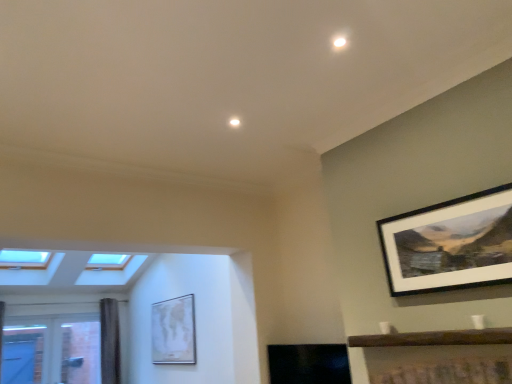
Where is `matte white map at center, the second picture frame positioned from the top`? The height and width of the screenshot is (384, 512). matte white map at center, the second picture frame positioned from the top is located at coordinates (173, 331).

Locate an element on the screen. wooden shelf at lower right is located at coordinates (435, 338).

Identify the location of matte white map at center, acting as the second picture frame starting from the front. (173, 331).

This screenshot has height=384, width=512. What are the coordinates of `window sill in front of the wooden-framed print at upper right, acting as the first picture frame starting from the front` in the screenshot? It's located at (435, 338).

Consider the image. Is wooden-framed print at upper right, the 1th picture frame in the top-to-bottom sequence, thinner than wooden shelf at lower right?

Yes, wooden-framed print at upper right, the 1th picture frame in the top-to-bottom sequence, is thinner than wooden shelf at lower right.

From a real-world perspective, relative to wooden shelf at lower right, is wooden-framed print at upper right, the second picture frame viewed from the left, vertically above or below?

wooden-framed print at upper right, the second picture frame viewed from the left, is situated higher than wooden shelf at lower right in the real world.

Between clear glass window at lower left and wooden shelf at lower right, which one appears on the right side from the viewer's perspective?

wooden shelf at lower right.

Considering their positions, is clear glass window at lower left located in front of or behind wooden shelf at lower right?

clear glass window at lower left is behind wooden shelf at lower right.

Are clear glass window at lower left and wooden shelf at lower right located far from each other?

Yes, clear glass window at lower left and wooden shelf at lower right are located far from each other.

Does clear glass window at lower left have a larger size compared to wooden shelf at lower right?

Indeed, clear glass window at lower left has a larger size compared to wooden shelf at lower right.

From the image's perspective, is matte white map at center, marked as the 2th picture frame in a right-to-left arrangement, beneath dark gray textured curtain at left?

No.

Is matte white map at center, placed as the 1th picture frame when sorted from back to front, next to dark gray textured curtain at left?

No, matte white map at center, placed as the 1th picture frame when sorted from back to front, is not touching dark gray textured curtain at left.

How many degrees apart are the facing directions of matte white map at center, marked as the 2th picture frame in a right-to-left arrangement, and dark gray textured curtain at left?

The angular difference between matte white map at center, marked as the 2th picture frame in a right-to-left arrangement, and dark gray textured curtain at left is 89.7 degrees.

From their relative heights in the image, would you say matte white map at center, positioned as the first picture frame in left-to-right order, is taller or shorter than dark gray textured curtain at left?

Considering their sizes, matte white map at center, positioned as the first picture frame in left-to-right order, has less height than dark gray textured curtain at left.

Is clear glass window at lower left located outside matte white map at center, marked as the 2th picture frame in a right-to-left arrangement?

Indeed, clear glass window at lower left is completely outside matte white map at center, marked as the 2th picture frame in a right-to-left arrangement.

From a real-world perspective, does clear glass window at lower left sit lower than matte white map at center, marked as the 2th picture frame in a right-to-left arrangement?

Indeed, from a real-world perspective, clear glass window at lower left is positioned beneath matte white map at center, marked as the 2th picture frame in a right-to-left arrangement.

Is point (49, 318) positioned behind point (163, 314)?

Yes, point (49, 318) is farther from viewer.

Does clear glass window at lower left touch wooden-framed print at upper right, the 1th picture frame in the top-to-bottom sequence?

No, clear glass window at lower left is not in contact with wooden-framed print at upper right, the 1th picture frame in the top-to-bottom sequence.

Considering the sizes of objects clear glass window at lower left and wooden-framed print at upper right, the 1th picture frame in the top-to-bottom sequence, in the image provided, who is shorter, clear glass window at lower left or wooden-framed print at upper right, the 1th picture frame in the top-to-bottom sequence,?

Standing shorter between the two is wooden-framed print at upper right, the 1th picture frame in the top-to-bottom sequence.

Is point (87, 334) closer or farther from the camera than point (483, 228)?

Point (87, 334) is farther from the camera than point (483, 228).

Locate an element on the screen. This screenshot has width=512, height=384. the 2nd picture frame located above the clear glass window at lower left (from a real-world perspective) is located at coordinates (450, 244).

Is wooden shelf at lower right oriented towards matte white map at center, placed as the 1th picture frame when sorted from back to front?

No, wooden shelf at lower right is not facing towards matte white map at center, placed as the 1th picture frame when sorted from back to front.

Is wooden shelf at lower right completely or partially outside of matte white map at center, placed as the first picture frame when sorted from bottom to top?

Yes, wooden shelf at lower right is located beyond the bounds of matte white map at center, placed as the first picture frame when sorted from bottom to top.

In the scene shown: Considering the sizes of wooden shelf at lower right and matte white map at center, acting as the second picture frame starting from the front, in the image, is wooden shelf at lower right taller or shorter than matte white map at center, acting as the second picture frame starting from the front,?

wooden shelf at lower right is shorter than matte white map at center, acting as the second picture frame starting from the front.

From the picture: How many degrees apart are the facing directions of wooden shelf at lower right and matte white map at center, the second picture frame positioned from the top?

The angle between the facing direction of wooden shelf at lower right and the facing direction of matte white map at center, the second picture frame positioned from the top, is 0.394 degrees.

From the image's perspective, is matte white map at center, positioned as the first picture frame in left-to-right order, under wooden-framed print at upper right, the 1th picture frame in the top-to-bottom sequence?

Indeed, from the image's perspective, matte white map at center, positioned as the first picture frame in left-to-right order, is shown beneath wooden-framed print at upper right, the 1th picture frame in the top-to-bottom sequence.

Is matte white map at center, the second picture frame positioned from the top, at the left side of wooden-framed print at upper right, the 1th picture frame in the top-to-bottom sequence?

Yes, matte white map at center, the second picture frame positioned from the top, is to the left of wooden-framed print at upper right, the 1th picture frame in the top-to-bottom sequence.

Based on the photo, is matte white map at center, placed as the first picture frame when sorted from bottom to top, taller or shorter than wooden-framed print at upper right, arranged as the 2th picture frame when ordered from the bottom?

matte white map at center, placed as the first picture frame when sorted from bottom to top, is taller than wooden-framed print at upper right, arranged as the 2th picture frame when ordered from the bottom.

Identify the location of picture frame above the matte white map at center, marked as the 2th picture frame in a right-to-left arrangement (from a real-world perspective). The image size is (512, 384). (450, 244).

At what (x,y) coordinates should I click in order to perform the action: click on window sill below the wooden-framed print at upper right, the 1th picture frame in the top-to-bottom sequence (from the image's perspective). Please return your answer as a coordinate pair (x, y). This screenshot has height=384, width=512. Looking at the image, I should click on (435, 338).

Locate an element on the screen. This screenshot has width=512, height=384. window sill that is on the right side of clear glass window at lower left is located at coordinates (435, 338).

When comparing their distances from wooden shelf at lower right, does clear glass window at lower left or matte white map at center, placed as the 1th picture frame when sorted from back to front, seem further?

Among the two, clear glass window at lower left is located further to wooden shelf at lower right.

Estimate the real-world distances between objects in this image. Which object is closer to wooden shelf at lower right, matte white map at center, acting as the second picture frame starting from the front, or dark gray textured curtain at left?

Among the two, matte white map at center, acting as the second picture frame starting from the front, is located nearer to wooden shelf at lower right.

Considering their positions, is wooden shelf at lower right positioned closer to matte white map at center, positioned as the first picture frame in left-to-right order, than dark gray textured curtain at left?

dark gray textured curtain at left is closer to matte white map at center, positioned as the first picture frame in left-to-right order.

Estimate the real-world distances between objects in this image. Which object is further from wooden shelf at lower right, wooden-framed print at upper right, the second picture frame viewed from the left, or matte white map at center, placed as the first picture frame when sorted from bottom to top?

matte white map at center, placed as the first picture frame when sorted from bottom to top, is further to wooden shelf at lower right.

When comparing their distances from dark gray textured curtain at left, does clear glass window at lower left or wooden-framed print at upper right, marked as the 1th picture frame in a right-to-left arrangement, seem closer?

Based on the image, clear glass window at lower left appears to be nearer to dark gray textured curtain at left.

Which object lies nearer to the anchor point dark gray textured curtain at left, clear glass window at lower left or wooden shelf at lower right?

clear glass window at lower left.

Based on the photo, estimate the real-world distances between objects in this image. Which object is further from matte white map at center, the second picture frame positioned from the top, wooden shelf at lower right or clear glass window at lower left?

wooden shelf at lower right is positioned further to the anchor matte white map at center, the second picture frame positioned from the top.

When comparing their distances from wooden-framed print at upper right, the second picture frame viewed from the left, does dark gray textured curtain at left or clear glass window at lower left seem closer?

The object closer to wooden-framed print at upper right, the second picture frame viewed from the left, is dark gray textured curtain at left.

Identify the location of window between wooden shelf at lower right and dark gray textured curtain at left along the z-axis. The width and height of the screenshot is (512, 384). (62, 348).

This screenshot has width=512, height=384. Find the location of `curtain situated between clear glass window at lower left and matte white map at center, positioned as the first picture frame in left-to-right order, from left to right`. curtain situated between clear glass window at lower left and matte white map at center, positioned as the first picture frame in left-to-right order, from left to right is located at coordinates (110, 342).

Where is `picture frame between wooden-framed print at upper right, arranged as the 2th picture frame when ordered from the bottom, and dark gray textured curtain at left from front to back`? picture frame between wooden-framed print at upper right, arranged as the 2th picture frame when ordered from the bottom, and dark gray textured curtain at left from front to back is located at coordinates (173, 331).

This screenshot has width=512, height=384. In order to click on picture frame between wooden shelf at lower right and matte white map at center, marked as the 2th picture frame in a right-to-left arrangement, from front to back in this screenshot , I will do `click(450, 244)`.